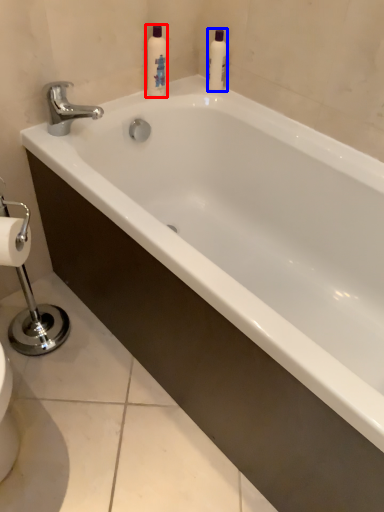
Question: Which object appears closest to the camera in this image, cleaning product (highlighted by a red box) or cleaning product (highlighted by a blue box)?

Choices:
 (A) cleaning product
 (B) cleaning product

Answer: (A)